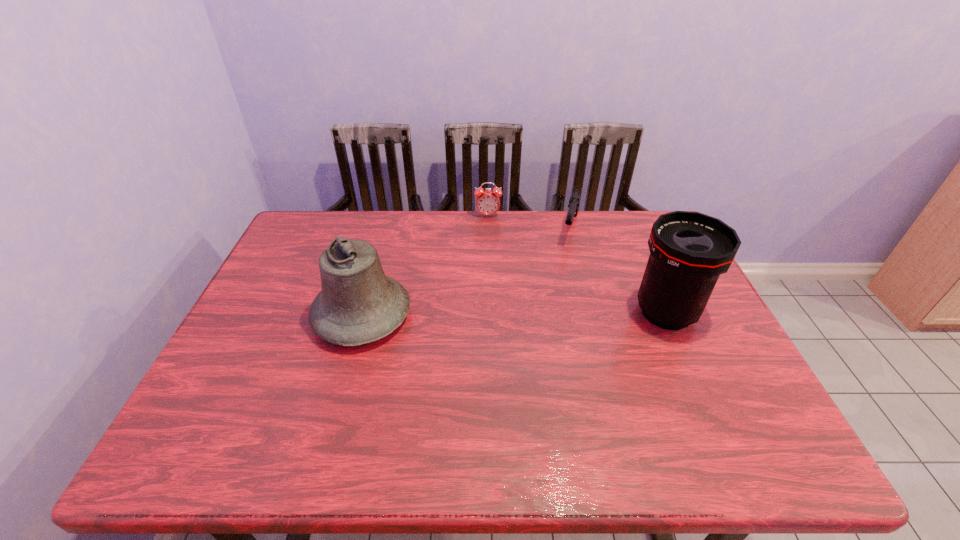
The image size is (960, 540). Identify the location of bell. (358, 304).

Where is `telephoto lens`? This screenshot has width=960, height=540. telephoto lens is located at coordinates (688, 250).

You are a GUI agent. You are given a task and a screenshot of the screen. Output one action in this format:
    pyautogui.click(x=<x>, y=<y>)
    Task: Click on the third object from right to left
    This screenshot has height=540, width=960.
    Given the screenshot: What is the action you would take?
    pyautogui.click(x=487, y=202)

You are a GUI agent. You are given a task and a screenshot of the screen. Output one action in this format:
    pyautogui.click(x=<x>, y=<y>)
    Task: Click on the second object from right to left
    This screenshot has height=540, width=960.
    Given the screenshot: What is the action you would take?
    pyautogui.click(x=575, y=198)

At what (x,y) coordinates should I click in order to perform the action: click on vacant region located 0.070m on the front of the leftmost object. Please return your answer as a coordinate pair (x, y). Looking at the image, I should click on (345, 378).

Locate an element on the screen. free space located on the left of the rightmost object is located at coordinates (605, 313).

At what (x,y) coordinates should I click in order to perform the action: click on free space located 0.090m on the face of the second object from left to right. Please return your answer as a coordinate pair (x, y). The width and height of the screenshot is (960, 540). Looking at the image, I should click on (490, 234).

At what (x,y) coordinates should I click in order to perform the action: click on vacant space located 0.140m on the face of the second object from left to right. Please return your answer as a coordinate pair (x, y). The width and height of the screenshot is (960, 540). Looking at the image, I should click on (490, 243).

Image resolution: width=960 pixels, height=540 pixels. I want to click on free region located 0.080m on the face of the second object from left to right, so click(x=490, y=232).

In order to click on free space located at the end of the barrel of the third object from left to right in this screenshot , I will do `click(558, 303)`.